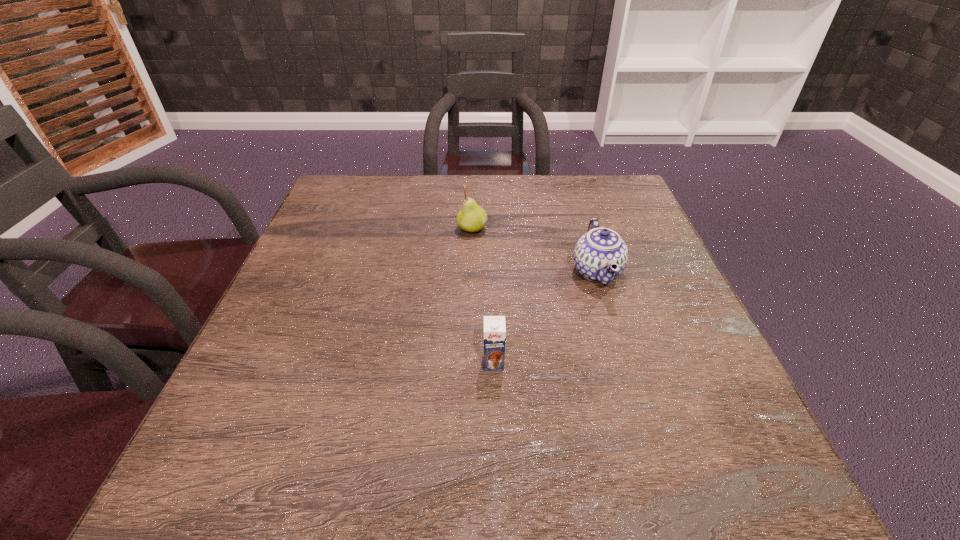
The width and height of the screenshot is (960, 540). I want to click on free spot that satisfies the following two spatial constraints: 1. at the spout of the second nearest object; 2. on the front label of the nearest object, so tap(625, 363).